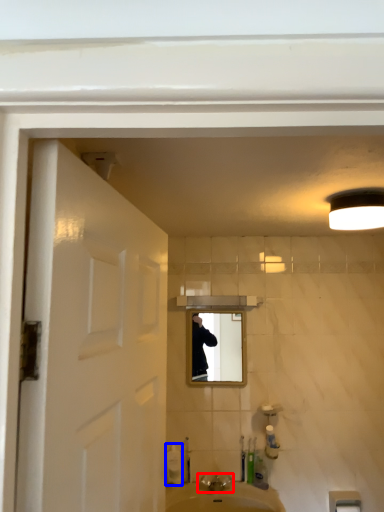
Question: Among these objects, which one is nearest to the camera, tap (highlighted by a red box) or soap dispenser (highlighted by a blue box)?

Choices:
 (A) tap
 (B) soap dispenser

Answer: (A)